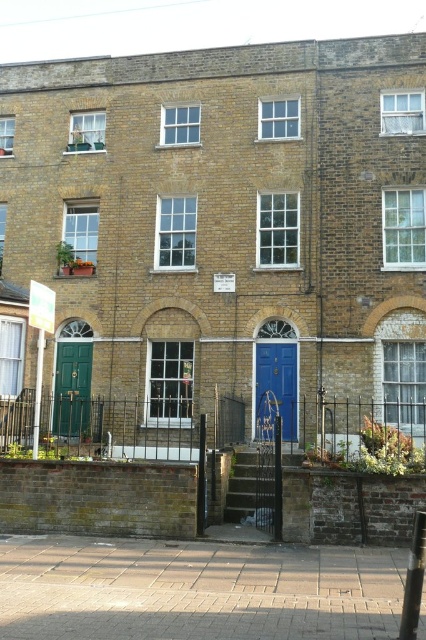
Question: Does green matte door at center-left have a lesser width compared to blue glossy door at center?

Choices:
 (A) yes
 (B) no

Answer: (A)

Question: Is green matte door at center-left to the right of blue glossy door at center from the viewer's perspective?

Choices:
 (A) no
 (B) yes

Answer: (A)

Question: Which object is closer to the camera taking this photo?

Choices:
 (A) blue glossy door at center
 (B) green matte door at center-left

Answer: (A)

Question: Which of the following is the closest to the observer?

Choices:
 (A) blue glossy door at center
 (B) green matte door at center-left

Answer: (A)

Question: Considering the relative positions of green matte door at center-left and blue glossy door at center in the image provided, where is green matte door at center-left located with respect to blue glossy door at center?

Choices:
 (A) right
 (B) left

Answer: (B)